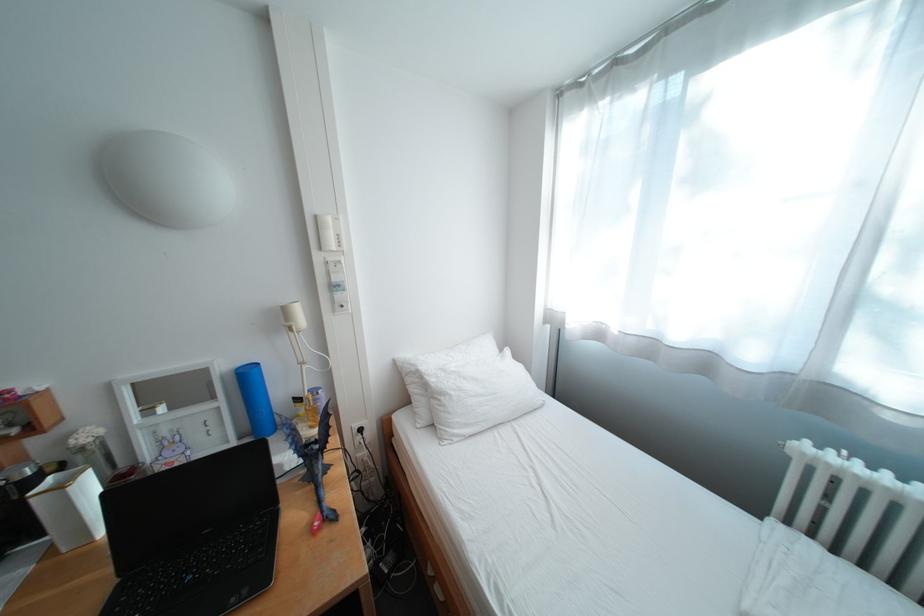
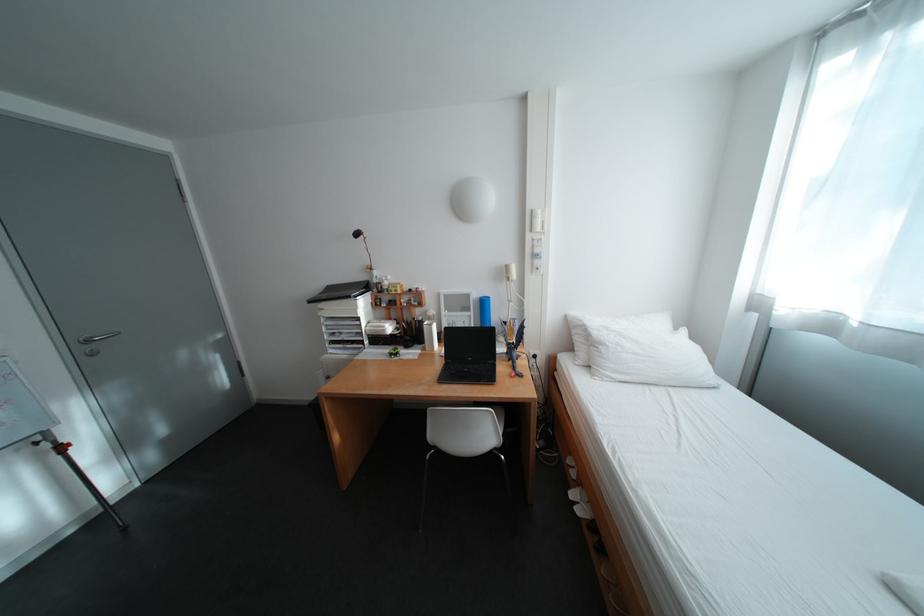
Where in the second image is the point corresponding to (216,533) from the first image?

(481, 360)